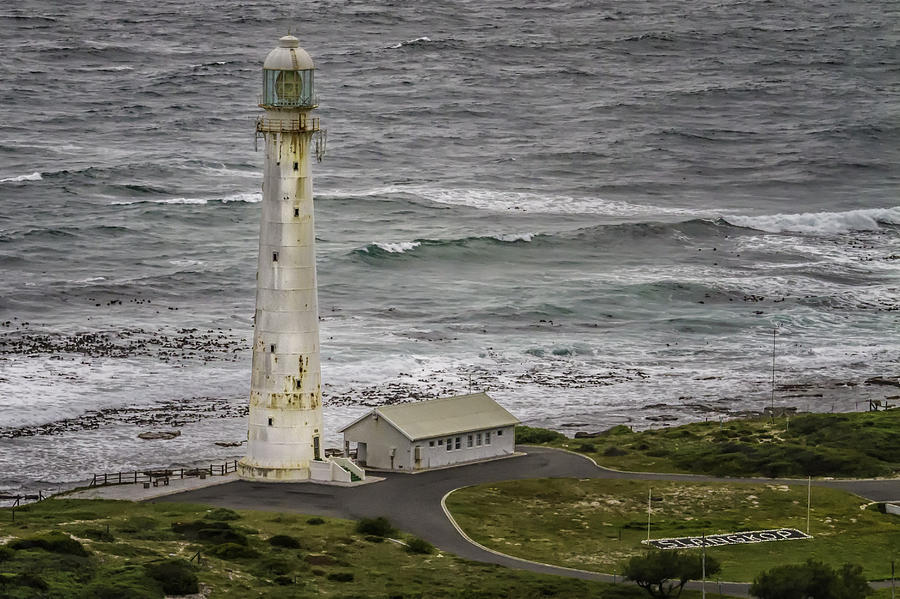
Image resolution: width=900 pixels, height=599 pixels. What are the coordinates of `bench` in the screenshot? It's located at (158, 482).